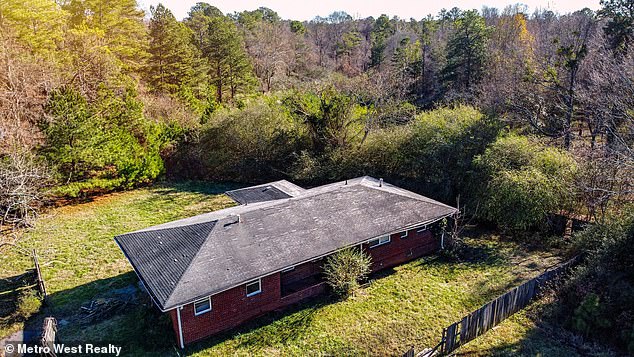
Locate an element on the screen. Image resolution: width=634 pixels, height=357 pixels. windows is located at coordinates (252, 287), (205, 306), (383, 241).